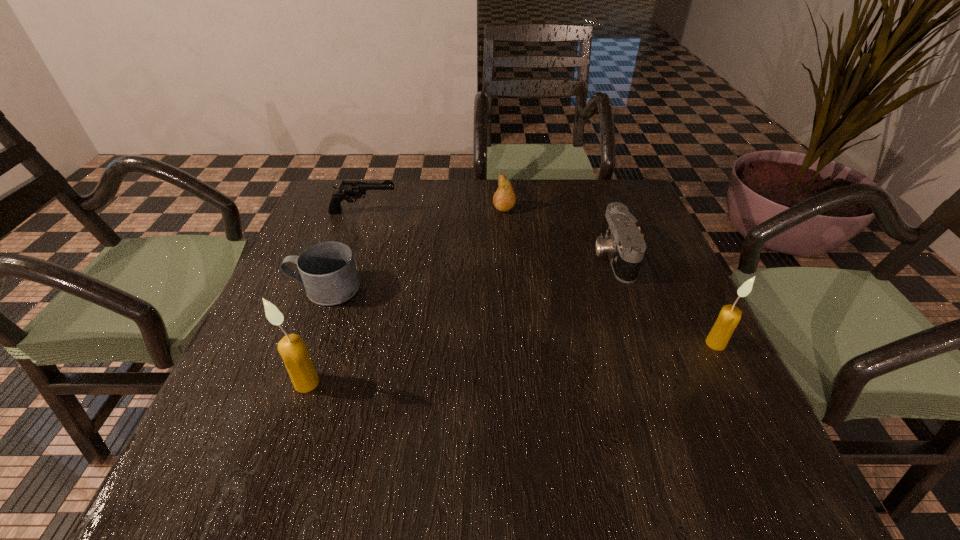
This screenshot has width=960, height=540. In order to click on free space located at the end of the barrel of the gun in this screenshot , I will do pyautogui.click(x=473, y=212).

The image size is (960, 540). I want to click on free location located 0.260m on the left of the third object from right to left, so click(399, 208).

Find the location of a particular element. vacant space positioned 0.300m on the lens of the camera is located at coordinates (471, 255).

This screenshot has width=960, height=540. Identify the location of vacant region located on the lens of the camera. (533, 255).

This screenshot has height=540, width=960. Identify the location of free spot located 0.250m on the lens of the camera. (492, 255).

At what (x,y) coordinates should I click in order to perform the action: click on gun at the far edge. Please return your answer as a coordinate pair (x, y). The width and height of the screenshot is (960, 540). Looking at the image, I should click on (348, 190).

At what (x,y) coordinates should I click in order to perform the action: click on pear that is at the far edge. Please return your answer as a coordinate pair (x, y). The height and width of the screenshot is (540, 960). Looking at the image, I should click on (504, 199).

Identify the location of object that is at the near edge. (292, 348).

This screenshot has width=960, height=540. I want to click on candle that is at the left edge, so click(x=292, y=348).

Where is `gun that is at the left edge`? The width and height of the screenshot is (960, 540). gun that is at the left edge is located at coordinates (348, 190).